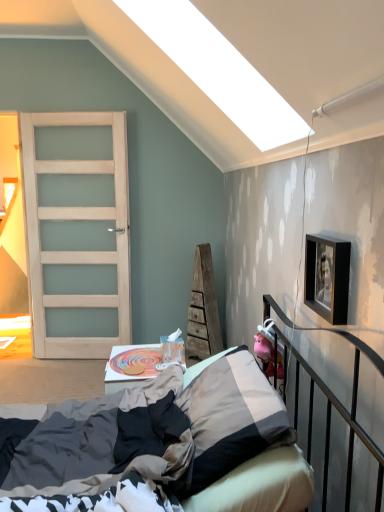
Image resolution: width=384 pixels, height=512 pixels. I want to click on free space above wooden toy at center (from a real-world perspective), so click(139, 358).